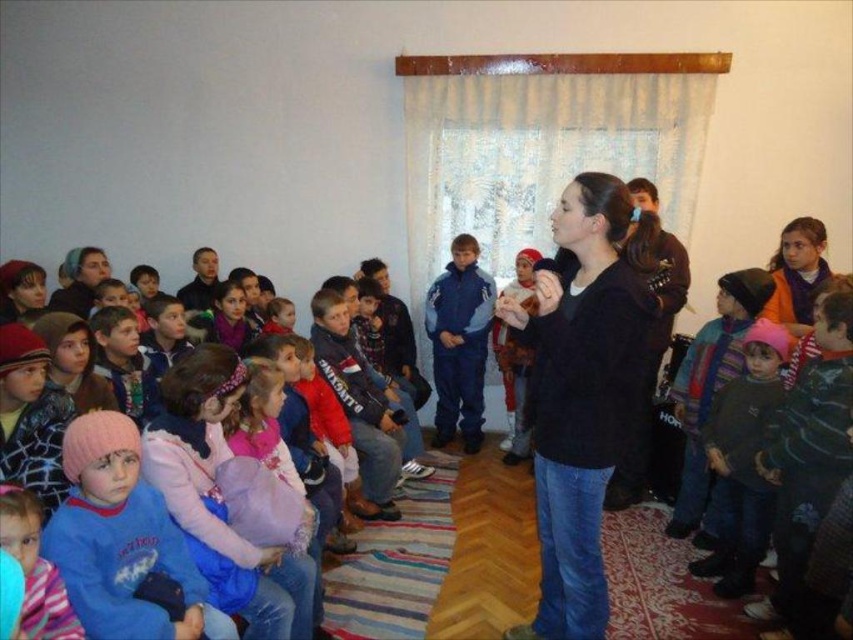
You are a photographer standing in front of the scene. You want to take a photo of both the pink fleece jacket at lower left and the blue fleece jacket at center. Which jacket will appear larger in the photo?

The pink fleece jacket at lower left will appear larger in the photo because it is closer to the viewer than the blue fleece jacket at center.